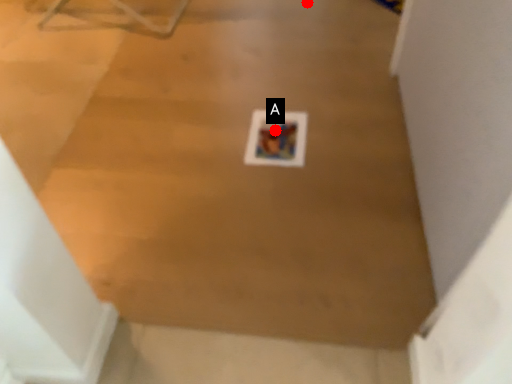
Question: Two points are circled on the image, labeled by A and B beside each circle. Which point is further to the camera?

Choices:
 (A) A is further
 (B) B is further

Answer: (B)